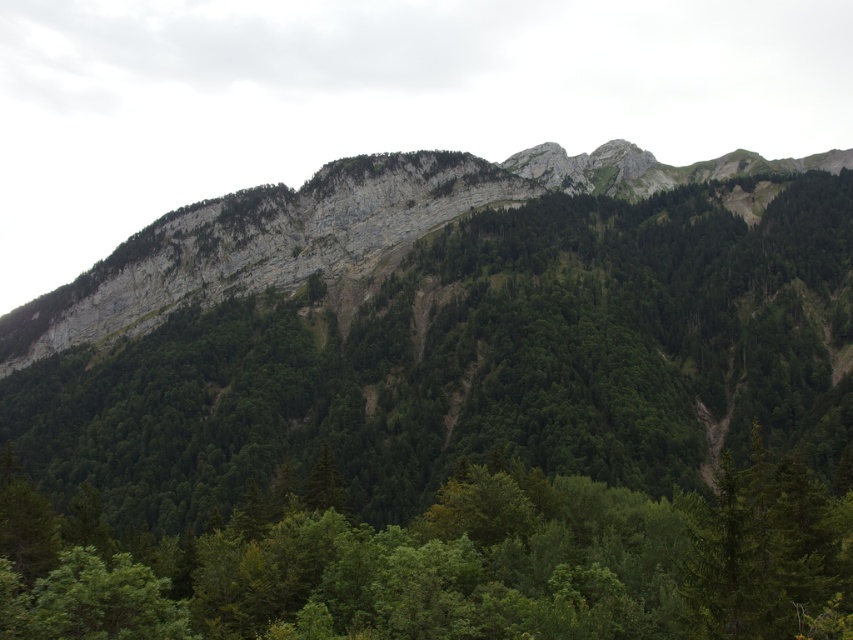
Based on the photo, can you confirm if green matte tree at lower center is positioned below green rock at center?

Yes, green matte tree at lower center is below green rock at center.

Which is in front, point (563, 524) or point (236, 252)?

Point (563, 524) is more forward.

I want to click on green matte tree at lower center, so click(450, 563).